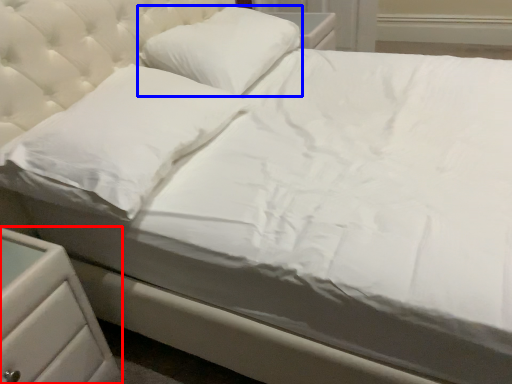
Question: Which object appears closest to the camera in this image, nightstand (highlighted by a red box) or pillow (highlighted by a blue box)?

Choices:
 (A) nightstand
 (B) pillow

Answer: (A)